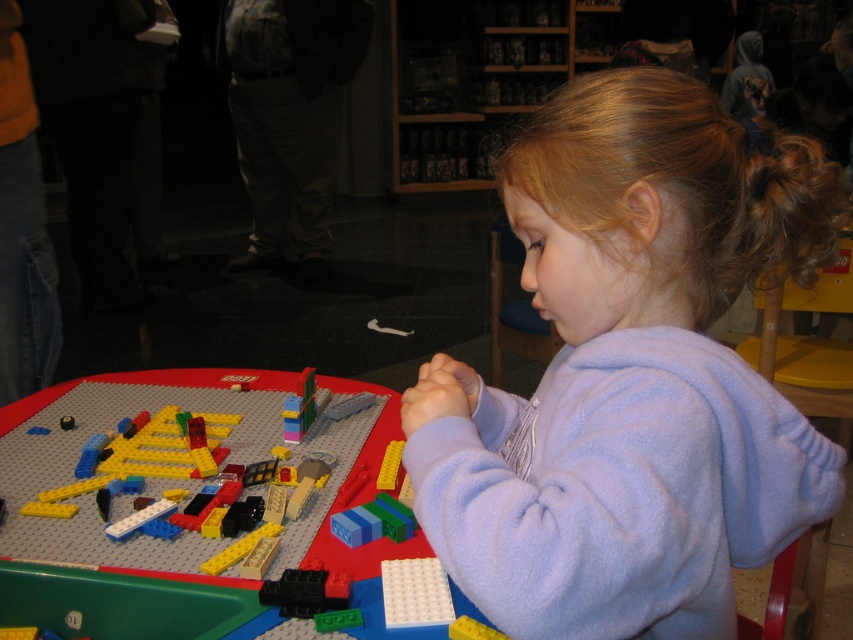
Question: Is white plastic plate at lower center closer to the viewer compared to yellow matte brick at lower center?

Choices:
 (A) no
 (B) yes

Answer: (A)

Question: Which point is farther to the camera?

Choices:
 (A) (469, 624)
 (B) (593, 444)
 (C) (386, 472)
 (D) (62, 588)

Answer: (C)

Question: Can you confirm if plastic lego table at center is positioned to the right of yellow matte brick at center?

Choices:
 (A) no
 (B) yes

Answer: (A)

Question: Does purple fleece at center have a smaller size compared to white plastic plate at lower center?

Choices:
 (A) no
 (B) yes

Answer: (A)

Question: Which object is positioned farthest from the white plastic plate at lower center?

Choices:
 (A) plastic lego table at center
 (B) yellow matte brick at lower center
 (C) purple fleece at center

Answer: (C)

Question: Which of the following is the closest to the observer?

Choices:
 (A) yellow matte brick at lower center
 (B) plastic lego table at center

Answer: (A)